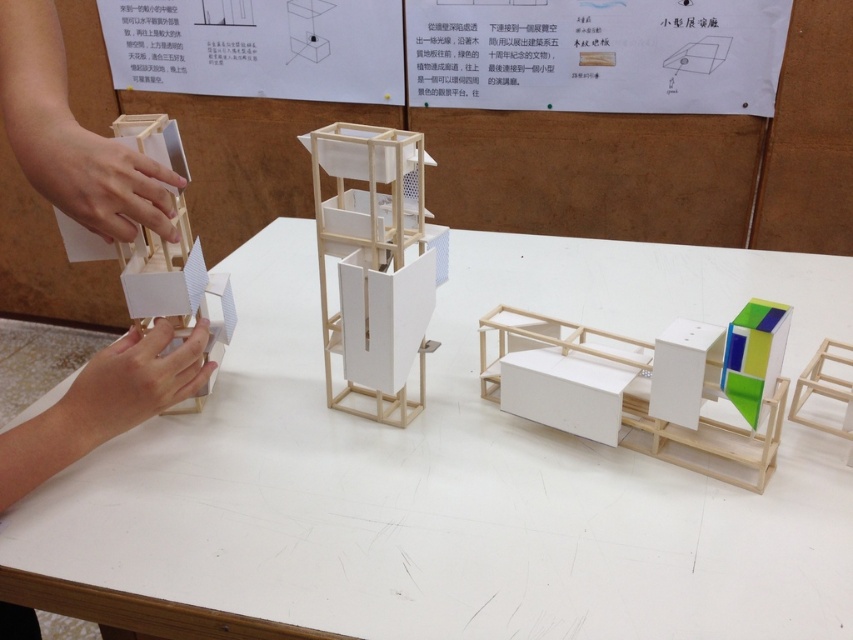
Does white matte table at center have a lesser height compared to wooden model at left?

Yes.

Looking at this image, is white matte table at center to the left of wooden model at left from the viewer's perspective?

No, white matte table at center is not to the left of wooden model at left.

What do you see at coordinates (463, 472) in the screenshot? I see `white matte table at center` at bounding box center [463, 472].

At what (x,y) coordinates should I click in order to perform the action: click on white matte table at center. Please return your answer as a coordinate pair (x, y). The image size is (853, 640). Looking at the image, I should click on (463, 472).